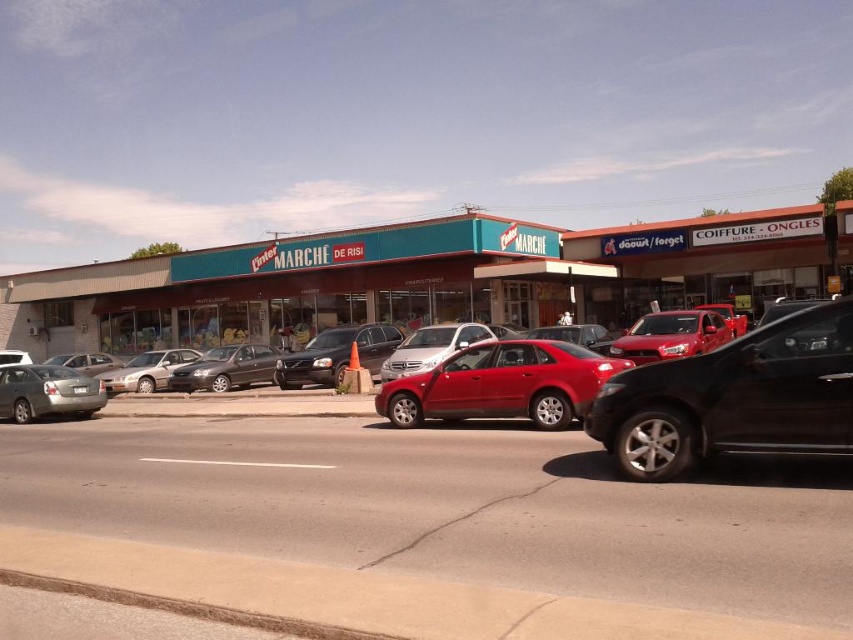
Can you confirm if black metallic sedan at center is bigger than satin silver sedan at center?

No, black metallic sedan at center is not bigger than satin silver sedan at center.

What do you see at coordinates (734, 397) in the screenshot? I see `black metallic sedan at center` at bounding box center [734, 397].

You are a GUI agent. You are given a task and a screenshot of the screen. Output one action in this format:
    pyautogui.click(x=<x>, y=<y>)
    Task: Click on the black metallic sedan at center
    The width and height of the screenshot is (853, 640).
    Given the screenshot: What is the action you would take?
    pyautogui.click(x=734, y=397)

Which is below, teal plastic building at center or silver metallic sedan at left?

silver metallic sedan at left

Who is higher up, teal plastic building at center or silver metallic sedan at left?

Positioned higher is teal plastic building at center.

I want to click on teal plastic building at center, so click(x=428, y=278).

Which is below, shiny red sedan at center or satin silver sedan at center?

satin silver sedan at center is below.

Between point (630, 337) and point (379, 369), which one is positioned in front?

Point (630, 337)

At what (x,y) coordinates should I click in order to perform the action: click on shiny red sedan at center. Please return your answer as a coordinate pair (x, y). Looking at the image, I should click on (671, 336).